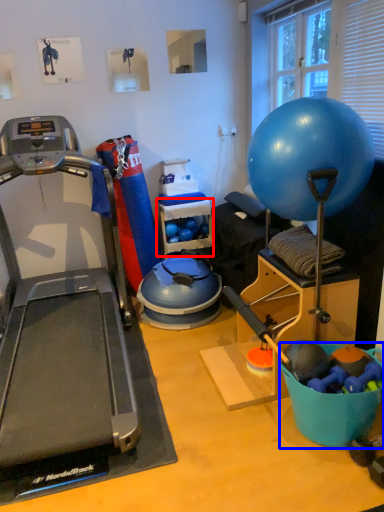
Question: Which point is closer to the camera, shelf (highlighted by a red box) or bowl (highlighted by a blue box)?

Choices:
 (A) shelf
 (B) bowl

Answer: (B)